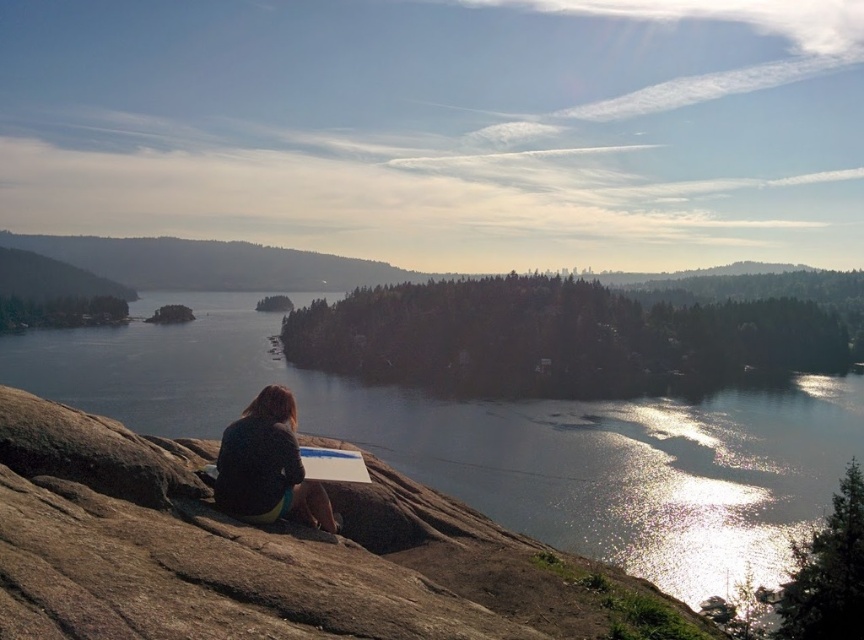
Between glistening water at center and dark blue fabric at center, which one is positioned higher?

dark blue fabric at center is above.

Can you confirm if glistening water at center is smaller than dark blue fabric at center?

No, glistening water at center is not smaller than dark blue fabric at center.

Which is in front, point (380, 413) or point (297, 493)?

Point (297, 493)

The height and width of the screenshot is (640, 864). In order to click on glistening water at center in this screenshot , I will do click(x=499, y=440).